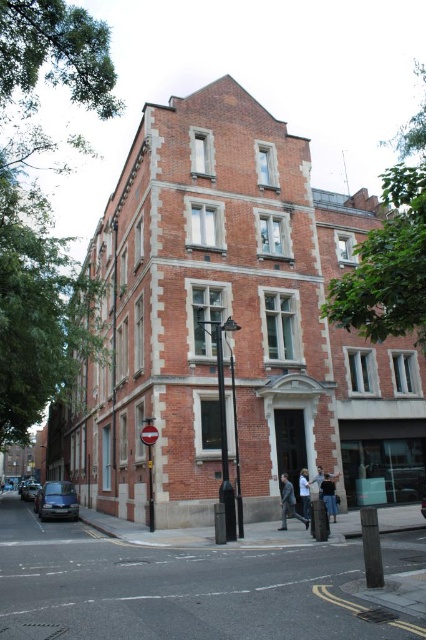
Can you confirm if dark gray jacket at center is positioned below white cotton shirt at center?

Correct, dark gray jacket at center is located below white cotton shirt at center.

Is dark gray jacket at center positioned before white cotton shirt at center?

Yes, dark gray jacket at center is closer to the viewer.

Which is in front, point (282, 524) or point (305, 513)?

Positioned in front is point (282, 524).

Locate an element on the screen. dark gray jacket at center is located at coordinates (288, 502).

Who is shorter, metallic blue car at lower left or white cotton shirt at center?

Standing shorter between the two is white cotton shirt at center.

Can you confirm if metallic blue car at lower left is thinner than white cotton shirt at center?

No.

Which is in front, point (36, 508) or point (305, 477)?

Point (305, 477) is more forward.

Where is `metallic blue car at lower left`? metallic blue car at lower left is located at coordinates (57, 500).

Can you confirm if dark gray jacket at center is thinner than light gray fabric jacket at center?

Incorrect, dark gray jacket at center's width is not less than light gray fabric jacket at center's.

Who is more distant from viewer, (284, 496) or (316, 488)?

The point (316, 488) is more distant.

Who is more distant from viewer, (281, 528) or (316, 484)?

Positioned behind is point (316, 484).

Where is `dark gray jacket at center`? The image size is (426, 640). dark gray jacket at center is located at coordinates (288, 502).